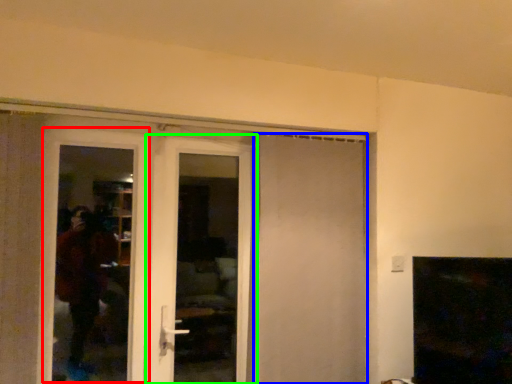
Question: Considering the real-world distances, which object is farthest from screen door (highlighted by a red box)? door (highlighted by a blue box) or door (highlighted by a green box)?

Choices:
 (A) door
 (B) door

Answer: (A)